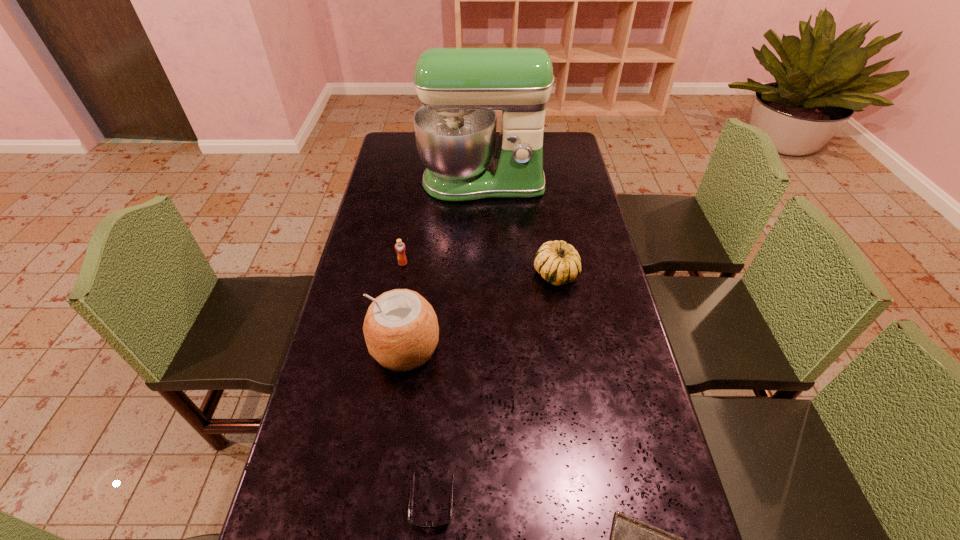
The width and height of the screenshot is (960, 540). I want to click on free spot between the sunglasses and the orange juice, so click(418, 382).

Identify which object is the nearest to the gourd. Please provide its 2D coordinates. Your answer should be formatted as a tuple, i.e. [(x, y)], where the tuple contains the x and y coordinates of a point satisfying the conditions above.

[(460, 88)]

Identify which object is located as the nearest to the gourd. Please provide its 2D coordinates. Your answer should be formatted as a tuple, i.e. [(x, y)], where the tuple contains the x and y coordinates of a point satisfying the conditions above.

[(460, 88)]